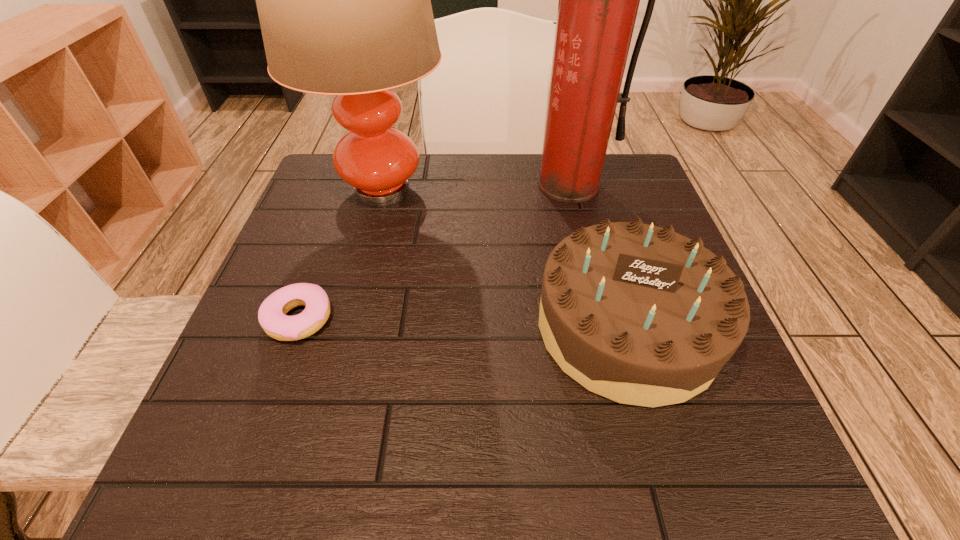
Where is `lamp`? The width and height of the screenshot is (960, 540). lamp is located at coordinates (344, 0).

The height and width of the screenshot is (540, 960). In order to click on fire extinguisher in this screenshot , I will do `click(598, 3)`.

Where is `birthday cake`? Image resolution: width=960 pixels, height=540 pixels. birthday cake is located at coordinates (639, 314).

At what (x,y) coordinates should I click in order to perform the action: click on doughnut. Please return your answer as a coordinate pair (x, y). Looking at the image, I should click on (272, 317).

You are a GUI agent. You are given a task and a screenshot of the screen. Output one action in this format:
    pyautogui.click(x=<x>, y=<y>)
    Task: Click on the free space located 0.300m on the front of the lamp
    
    Given the screenshot: What is the action you would take?
    pyautogui.click(x=338, y=354)

In order to click on free space located 0.290m at the nozzle of the fire extinguisher in this screenshot , I will do `click(598, 299)`.

Where is `vacant area located on the front-facing side of the third tallest object`? vacant area located on the front-facing side of the third tallest object is located at coordinates (667, 465).

The image size is (960, 540). Identify the location of vacant space located on the back of the shortest object. (348, 183).

Where is `lamp that is at the far edge`? This screenshot has width=960, height=540. lamp that is at the far edge is located at coordinates (344, 0).

Image resolution: width=960 pixels, height=540 pixels. I want to click on fire extinguisher situated at the far edge, so click(x=598, y=3).